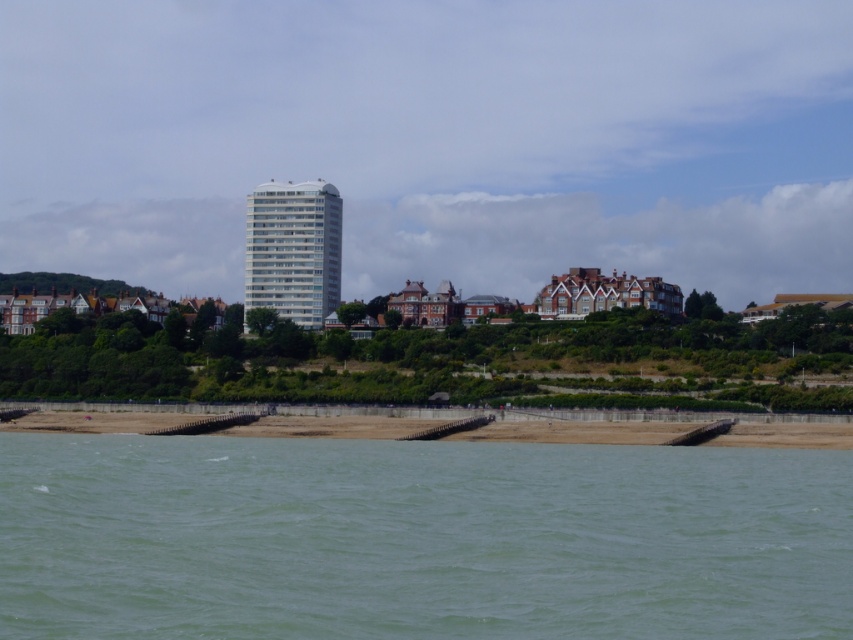
Question: Does green water at lower center have a greater width compared to brown sand at lower center?

Choices:
 (A) no
 (B) yes

Answer: (A)

Question: Can you confirm if green water at lower center is bigger than brown sand at lower center?

Choices:
 (A) no
 (B) yes

Answer: (B)

Question: Is the position of green water at lower center less distant than that of brown sand at lower center?

Choices:
 (A) no
 (B) yes

Answer: (B)

Question: Which object is farther from the camera taking this photo?

Choices:
 (A) brown sand at lower center
 (B) green water at lower center

Answer: (A)